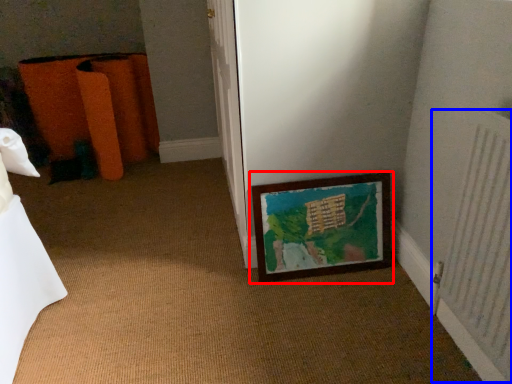
Question: Which object is closer to the camera taking this photo, picture frame (highlighted by a red box) or radiator (highlighted by a blue box)?

Choices:
 (A) picture frame
 (B) radiator

Answer: (B)